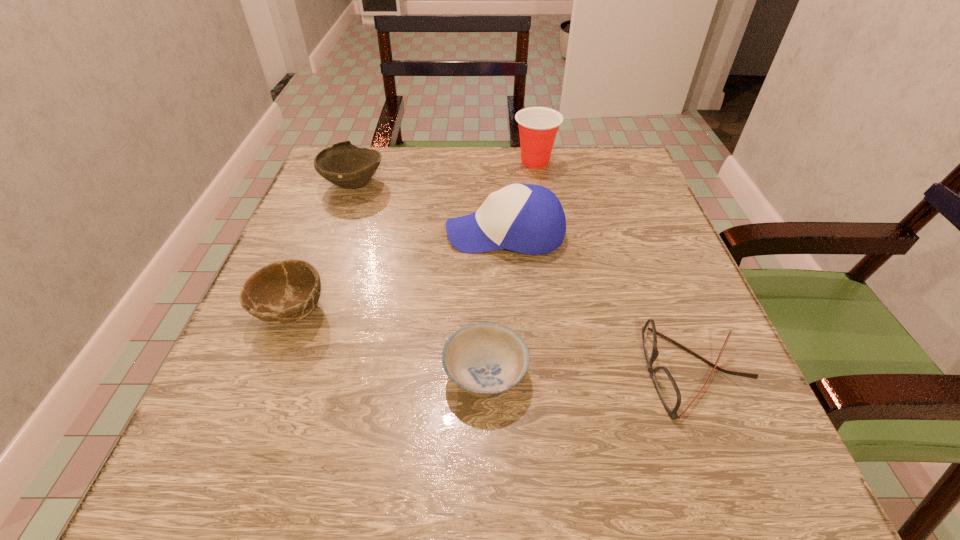
At what (x,y) coordinates should I click in order to perform the action: click on free space between the second nearest bowl and the farthest bowl. Please return your answer as a coordinate pair (x, y). This screenshot has height=540, width=960. Looking at the image, I should click on (323, 247).

This screenshot has height=540, width=960. Identify the location of vacant space that's between the rightmost object and the farthest bowl. (523, 278).

Identify the location of vacant point located between the baseball cap and the farthest bowl. This screenshot has height=540, width=960. (429, 208).

Identify the location of free area in between the spectacles and the farthest bowl. This screenshot has width=960, height=540. (523, 278).

At what (x,y) coordinates should I click in order to perform the action: click on free space between the second farthest bowl and the nearest bowl. Please return your answer as a coordinate pair (x, y). Image resolution: width=960 pixels, height=540 pixels. Looking at the image, I should click on (389, 343).

Where is `free space that is in between the farthest bowl and the cup`? free space that is in between the farthest bowl and the cup is located at coordinates (444, 172).

The height and width of the screenshot is (540, 960). In order to click on vacant point located between the cup and the nearest bowl in this screenshot , I will do `click(510, 268)`.

Point out which object is positioned as the second nearest to the spectacles. Please provide its 2D coordinates. Your answer should be formatted as a tuple, i.e. [(x, y)], where the tuple contains the x and y coordinates of a point satisfying the conditions above.

[(526, 218)]

Identify which object is located as the fifth nearest to the rightmost bowl. Please provide its 2D coordinates. Your answer should be formatted as a tuple, i.e. [(x, y)], where the tuple contains the x and y coordinates of a point satisfying the conditions above.

[(538, 126)]

This screenshot has width=960, height=540. What are the coordinates of `bowl that is the second closest to the rightmost bowl` in the screenshot? It's located at (343, 164).